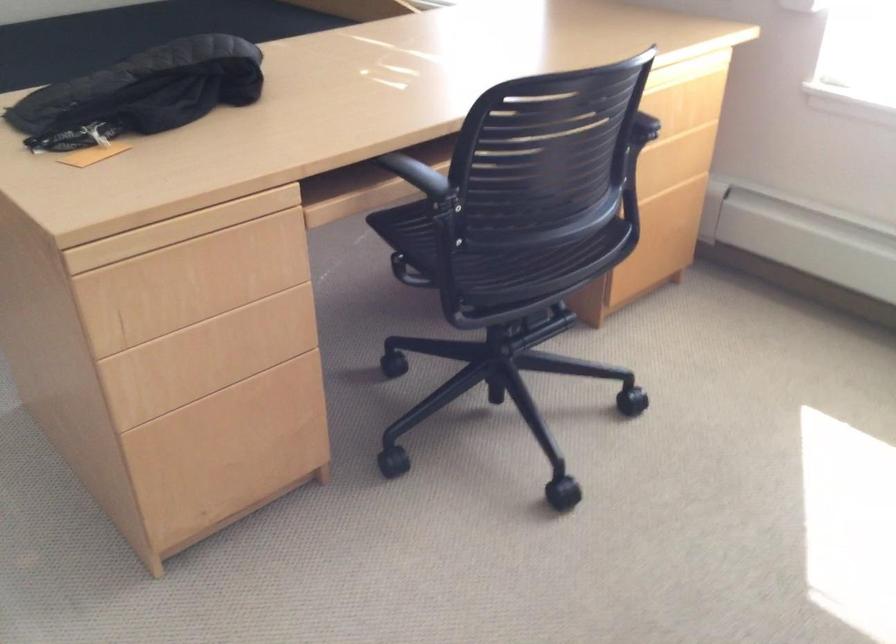
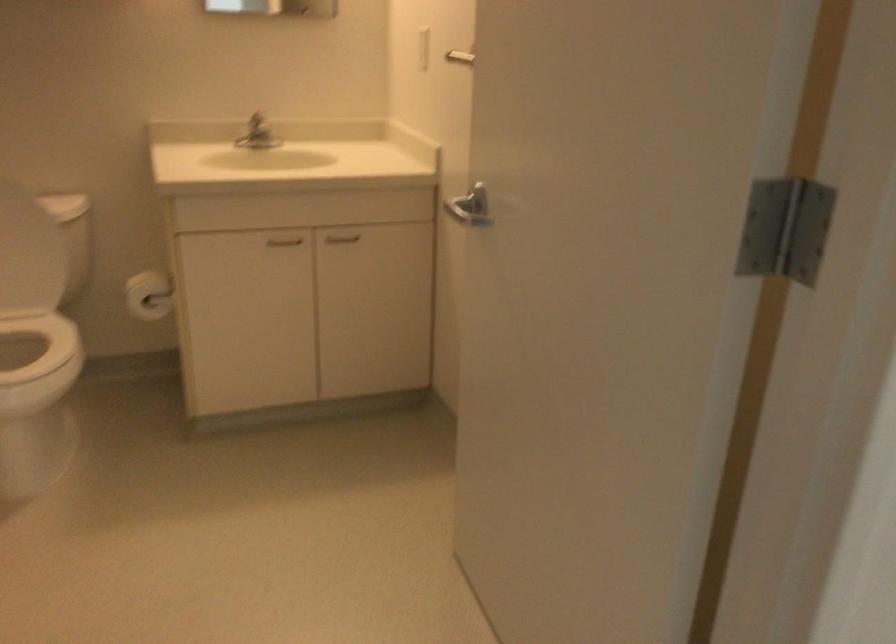
Question: The images are taken continuously from a first-person perspective. In which direction are you moving?

Choices:
 (A) Left
 (B) Right
 (C) Forward
 (D) Backward

Answer: (A)